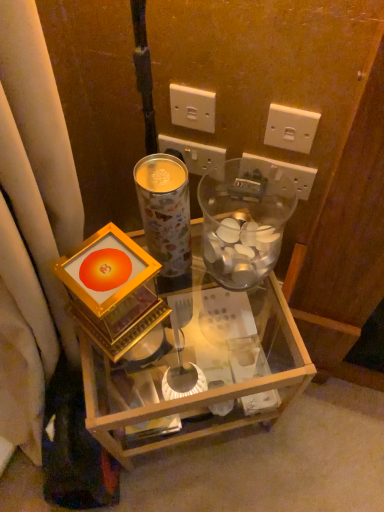
Question: From the image's perspective, would you say gold metallic frame at center is shown under white plastic power outlet at upper right, acting as the 1th power outlet starting from the right?

Choices:
 (A) no
 (B) yes

Answer: (B)

Question: Is gold metallic frame at center wider than white plastic power outlet at upper right, acting as the 1th power outlet starting from the right?

Choices:
 (A) yes
 (B) no

Answer: (A)

Question: Is gold metallic frame at center at the right side of white plastic power outlet at upper right, acting as the 1th power outlet starting from the right?

Choices:
 (A) yes
 (B) no

Answer: (B)

Question: Considering the relative positions of gold metallic frame at center and white plastic power outlet at upper right, acting as the 1th power outlet starting from the right, in the image provided, is gold metallic frame at center behind white plastic power outlet at upper right, acting as the 1th power outlet starting from the right,?

Choices:
 (A) no
 (B) yes

Answer: (A)

Question: Is gold metallic frame at center not within white plastic power outlet at upper right, acting as the 1th power outlet starting from the right?

Choices:
 (A) no
 (B) yes

Answer: (B)

Question: Considering the relative positions of gold metallic frame at center and white plastic power outlet at upper right, the fourth power outlet from the left, in the image provided, is gold metallic frame at center to the left of white plastic power outlet at upper right, the fourth power outlet from the left, from the viewer's perspective?

Choices:
 (A) no
 (B) yes

Answer: (B)

Question: Considering the relative sizes of white plastic power outlet at upper center, which is counted as the fourth power outlet, starting from the right, and white plastic power outlet at upper center, the 3th power outlet viewed from the right, in the image provided, is white plastic power outlet at upper center, which is counted as the fourth power outlet, starting from the right, shorter than white plastic power outlet at upper center, the 3th power outlet viewed from the right,?

Choices:
 (A) no
 (B) yes

Answer: (B)

Question: Are white plastic power outlet at upper center, placed as the 1th power outlet when sorted from left to right, and white plastic power outlet at upper center, the 3th power outlet viewed from the right, beside each other?

Choices:
 (A) no
 (B) yes

Answer: (B)

Question: Does white plastic power outlet at upper center, which is counted as the fourth power outlet, starting from the right, have a smaller size compared to white plastic power outlet at upper center, acting as the second power outlet starting from the left?

Choices:
 (A) yes
 (B) no

Answer: (A)

Question: Considering the relative sizes of white plastic power outlet at upper center, placed as the 1th power outlet when sorted from left to right, and white plastic power outlet at upper center, acting as the second power outlet starting from the left, in the image provided, is white plastic power outlet at upper center, placed as the 1th power outlet when sorted from left to right, taller than white plastic power outlet at upper center, acting as the second power outlet starting from the left,?

Choices:
 (A) yes
 (B) no

Answer: (B)

Question: Does white plastic power outlet at upper center, placed as the 1th power outlet when sorted from left to right, have a greater width compared to white plastic power outlet at upper center, acting as the second power outlet starting from the left?

Choices:
 (A) yes
 (B) no

Answer: (B)

Question: Does white plastic power outlet at upper center, placed as the 1th power outlet when sorted from left to right, appear on the left side of white plastic power outlet at upper center, the 3th power outlet viewed from the right?

Choices:
 (A) yes
 (B) no

Answer: (A)

Question: From the image's perspective, is white plastic power outlet at upper center, the 3th power outlet viewed from the right, below metallic floral-patterned coffee cup at center?

Choices:
 (A) yes
 (B) no

Answer: (B)